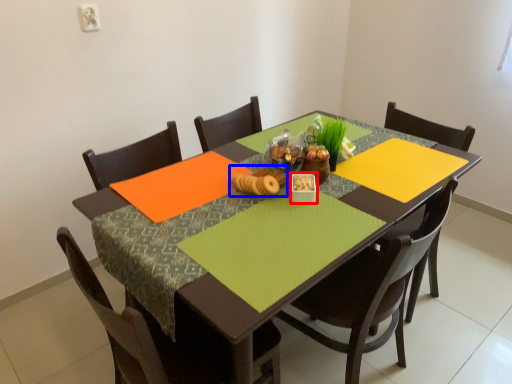
Question: Which point is further to the camera, tableware (highlighted by a red box) or food (highlighted by a blue box)?

Choices:
 (A) tableware
 (B) food

Answer: (A)